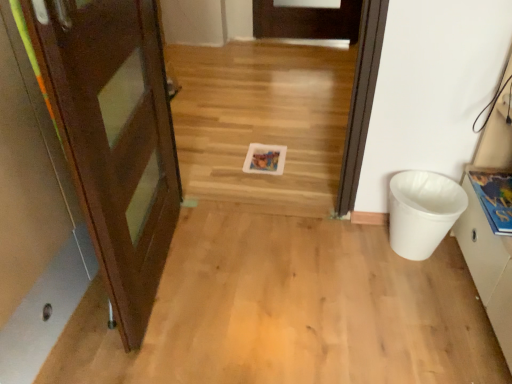
Question: Visually, is matte brown door at left positioned to the left or to the right of white matte cabinet at right?

Choices:
 (A) left
 (B) right

Answer: (A)

Question: Is matte brown door at left wider or thinner than white matte cabinet at right?

Choices:
 (A) thin
 (B) wide

Answer: (B)

Question: Based on their relative distances, which object is farther from the white matte cabinet at right?

Choices:
 (A) white plastic trash can at right
 (B) matte brown door at left

Answer: (B)

Question: Which of these objects is positioned farthest from the matte brown door at left?

Choices:
 (A) white plastic trash can at right
 (B) white matte cabinet at right

Answer: (B)